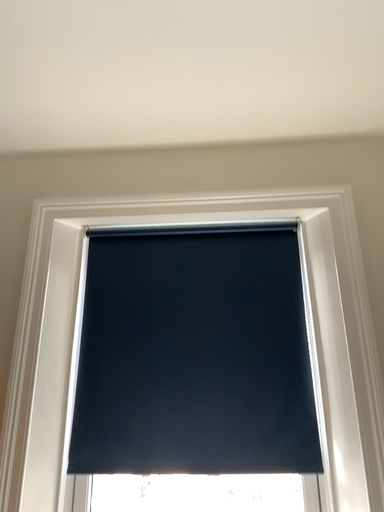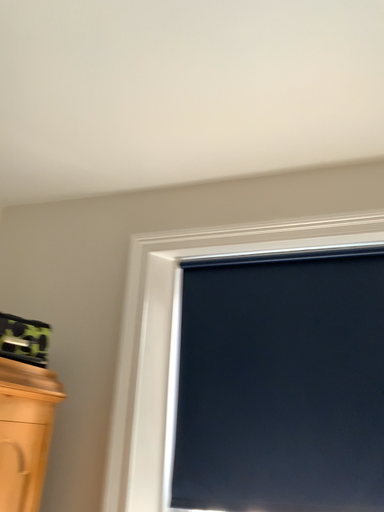
Question: How did the camera likely rotate when shooting the video?

Choices:
 (A) rotated right
 (B) rotated left

Answer: (B)